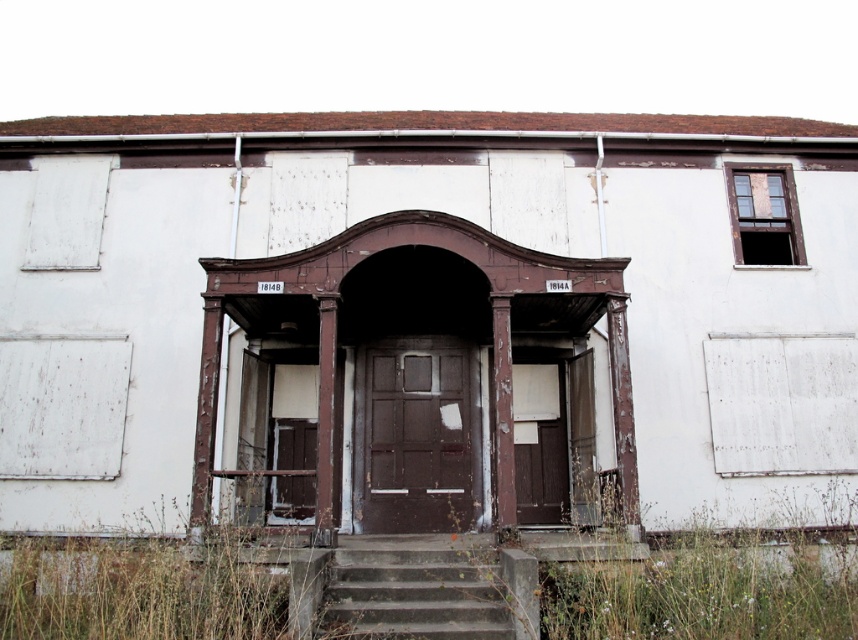
Question: Is the position of brown grass at lower left more distant than that of brown matte door at center?

Choices:
 (A) yes
 (B) no

Answer: (B)

Question: From the image, what is the correct spatial relationship of brown grass at lower left in relation to concrete/stained stairs at center?

Choices:
 (A) below
 (B) above

Answer: (A)

Question: Does brown grass at lower left appear under concrete/stained stairs at center?

Choices:
 (A) yes
 (B) no

Answer: (A)

Question: Which point is farther to the camera?

Choices:
 (A) brown matte door at center
 (B) brown grass at lower left
 (C) concrete/stained stairs at center

Answer: (A)

Question: Considering the real-world distances, which object is closest to the brown matte door at center?

Choices:
 (A) concrete/stained stairs at center
 (B) brown grass at lower left

Answer: (A)

Question: Among these objects, which one is farthest from the camera?

Choices:
 (A) concrete/stained stairs at center
 (B) brown grass at lower left
 (C) brown matte door at center

Answer: (C)